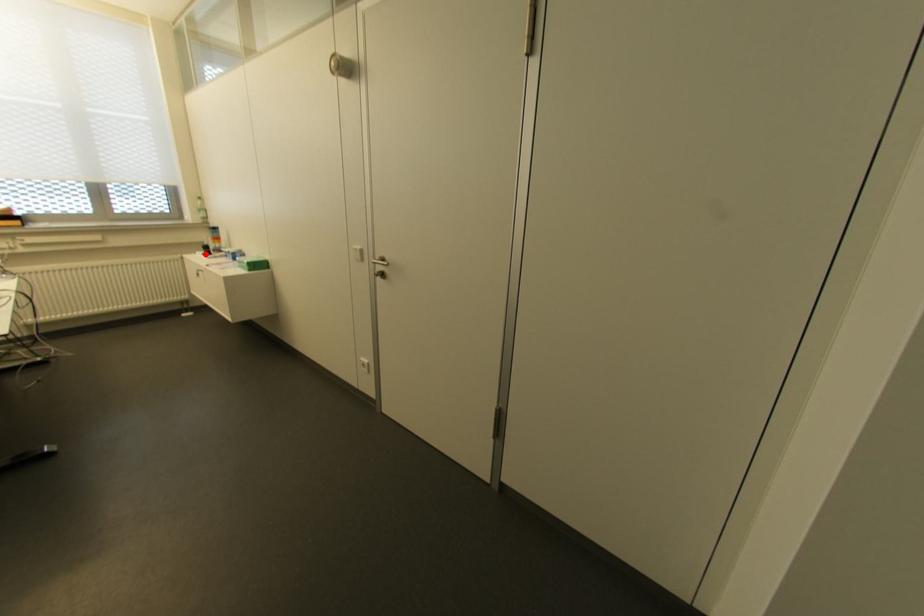
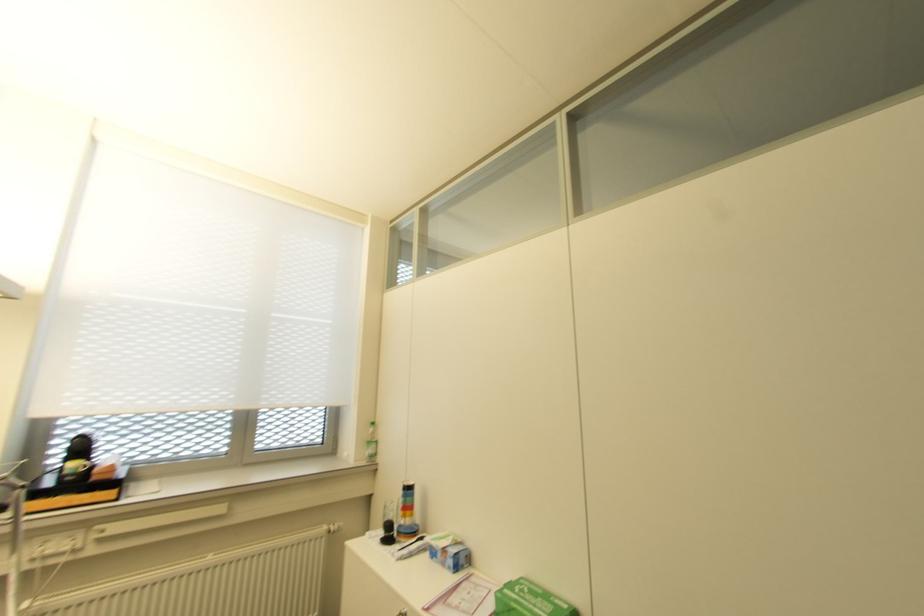
Locate, in the second image, the point that corresponds to the highlighted location in the first image.

(385, 540)